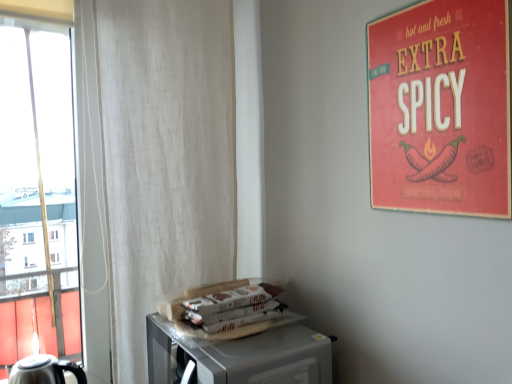
Find the location of a particular element. vacant area that is in front of white paper magazine at lower center is located at coordinates (243, 346).